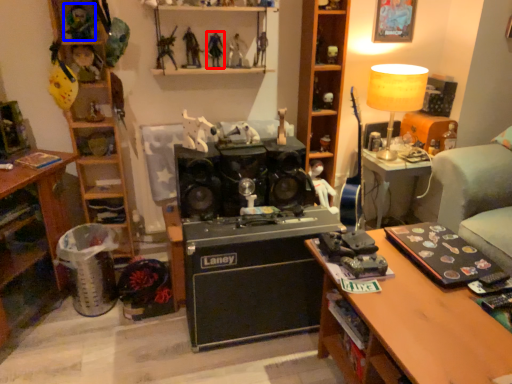
Question: Which object appears farthest to the camera in this image, toy (highlighted by a red box) or toy (highlighted by a blue box)?

Choices:
 (A) toy
 (B) toy

Answer: (A)